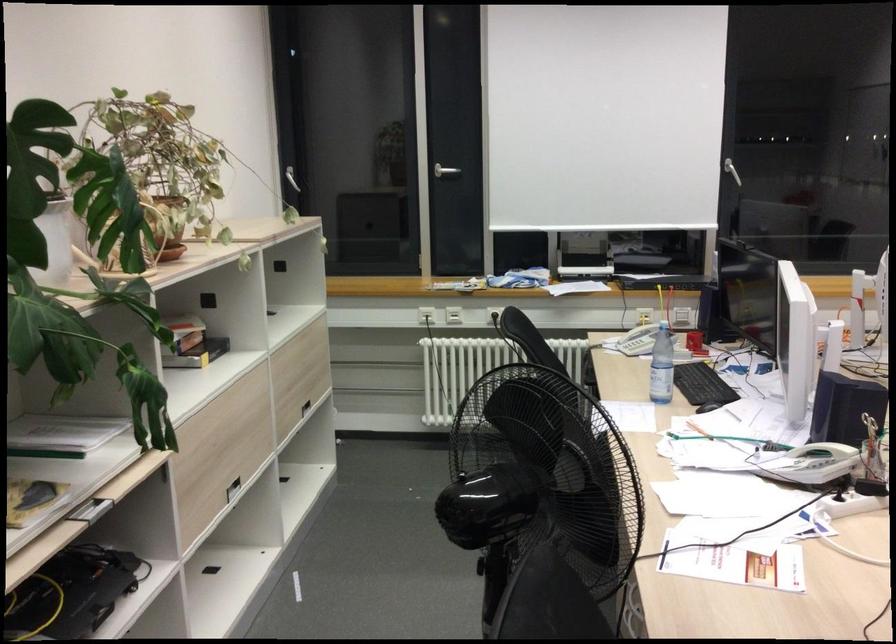
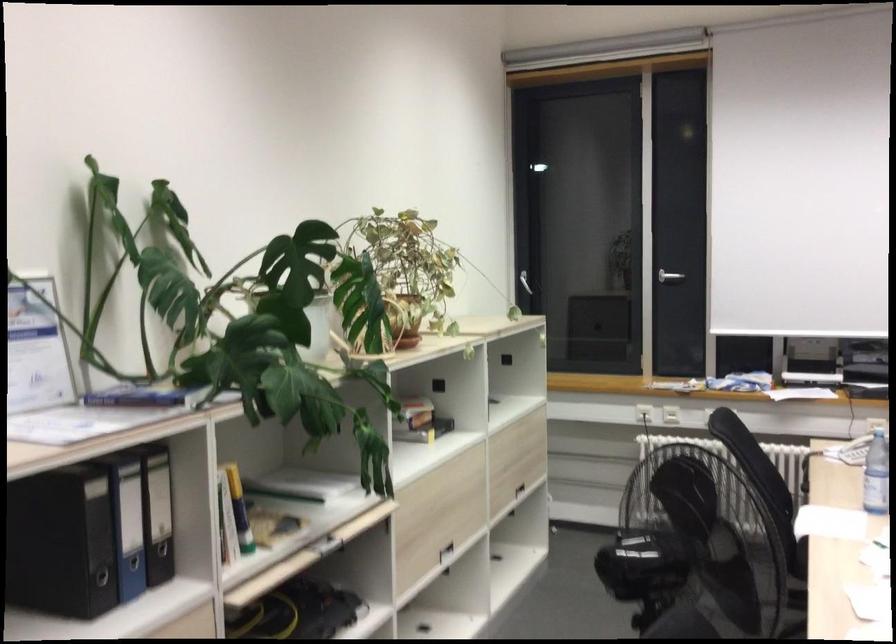
Question: The camera is either moving clockwise (left) or counter-clockwise (right) around the object. The first image is from the beginning of the video and the second image is from the end. Is the camera moving left or right when shooting the video?

Choices:
 (A) Left
 (B) Right

Answer: (B)